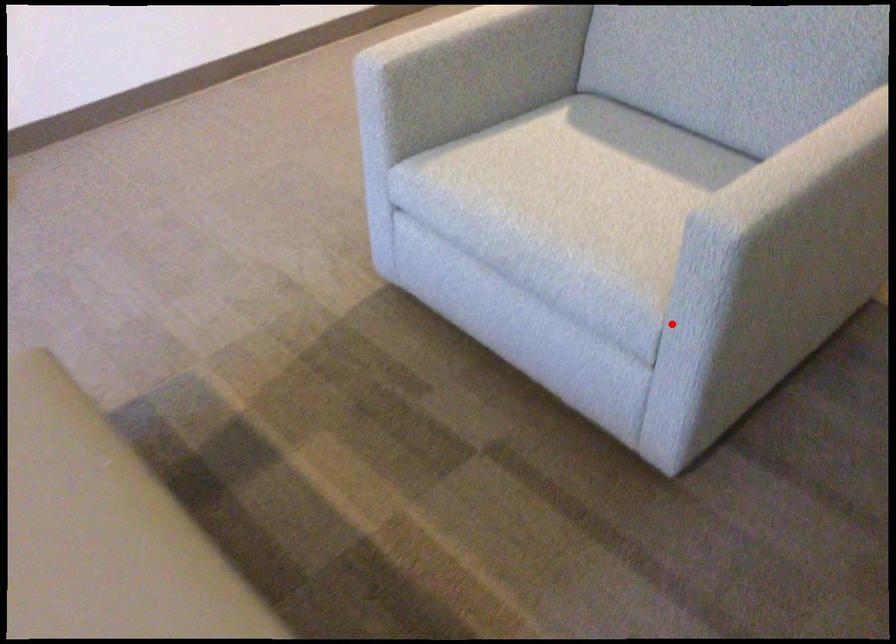
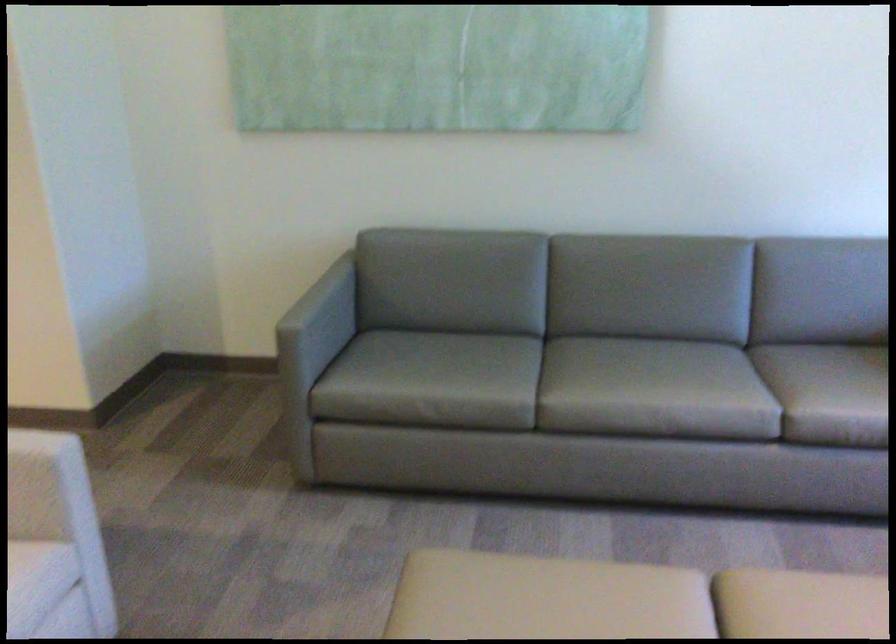
Locate, in the second image, the point that corresponds to the highlighted location in the first image.

(55, 542)